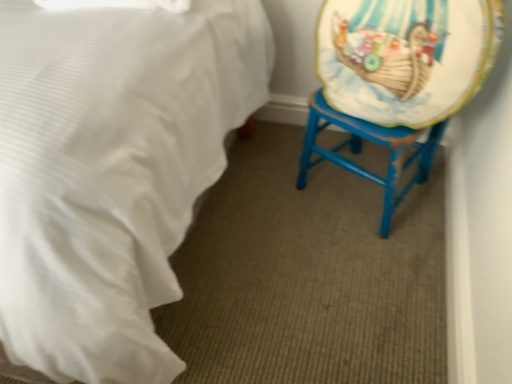
I want to click on free spot in front of blue painted wood swivel chair at right, so click(368, 263).